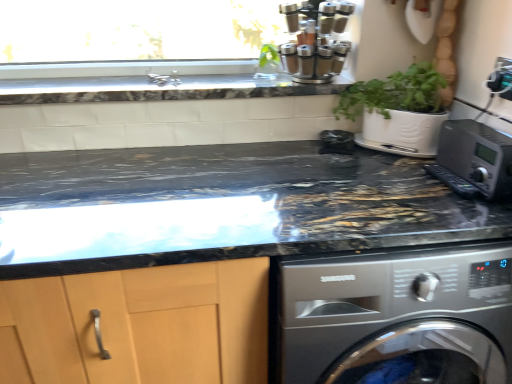
I want to click on vacant area on top of marble at center, positioned as the first countertop in bottom-to-top order (from a real-world perspective), so click(x=97, y=192).